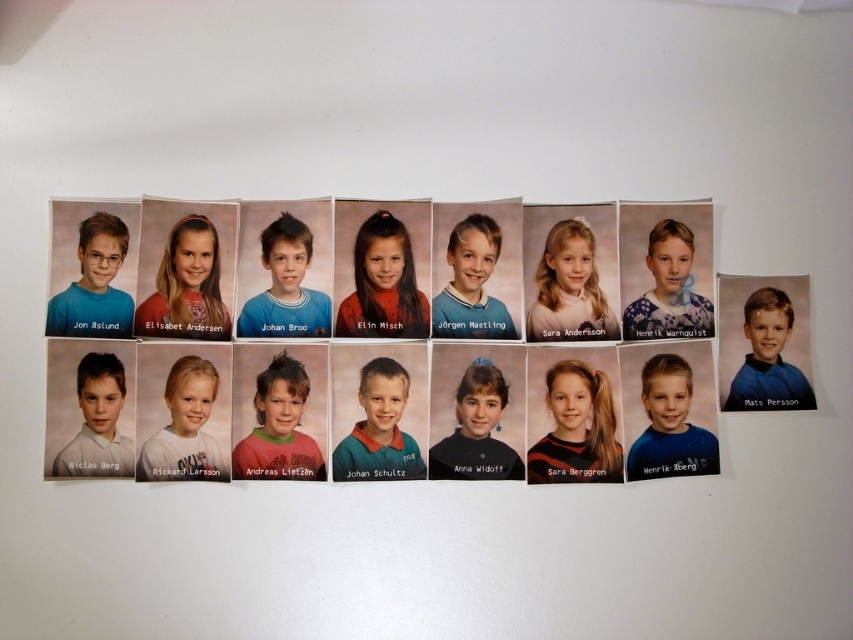
Question: Which point is closer to the camera taking this photo?

Choices:
 (A) (466, 216)
 (B) (242, 476)

Answer: (B)

Question: Among these points, which one is nearest to the camera?

Choices:
 (A) (440, 304)
 (B) (326, 310)
 (C) (579, 278)
 (D) (187, 330)

Answer: (D)

Question: Which of these objects is positioned farthest from the matte blue shirt at upper left?

Choices:
 (A) matte blue shirt at lower right
 (B) matte red shirt at center
 (C) matte red shirt at upper center
 (D) matte black hair at center

Answer: (A)

Question: Can you confirm if matte pink hair at center is positioned to the right of white smooth shirt at lower left?

Choices:
 (A) no
 (B) yes

Answer: (B)

Question: Does blue matte shirt at center appear on the left side of white smooth shirt at lower left?

Choices:
 (A) yes
 (B) no

Answer: (B)

Question: Can you confirm if pink matte shirt at center is positioned below white smooth shirt at lower left?

Choices:
 (A) yes
 (B) no

Answer: (B)